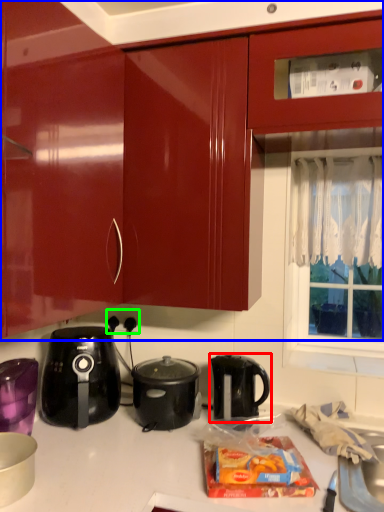
Question: Which object is the farthest from kettle (highlighted by a red box)? Choose among these: cabinetry (highlighted by a blue box) or electric outlet (highlighted by a green box).

Choices:
 (A) cabinetry
 (B) electric outlet

Answer: (A)